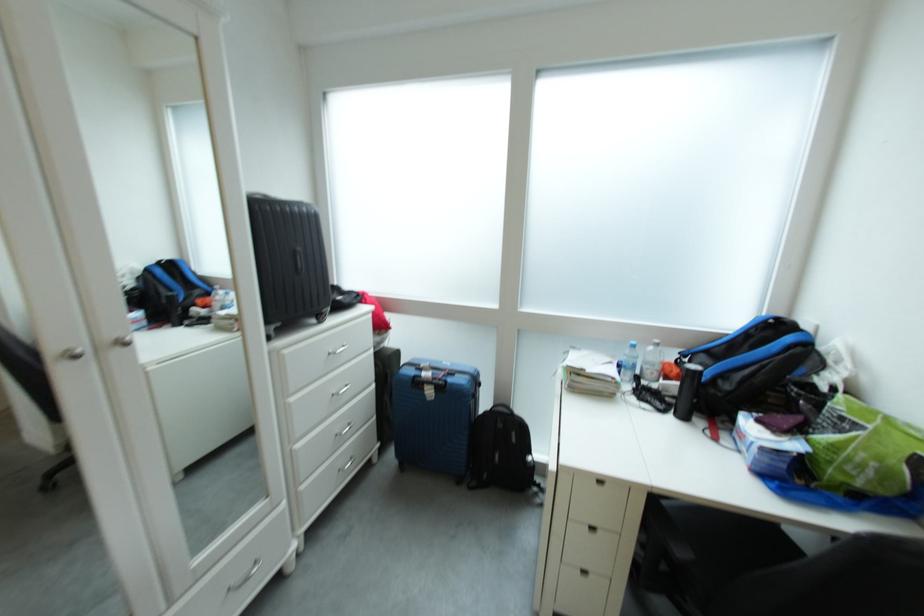
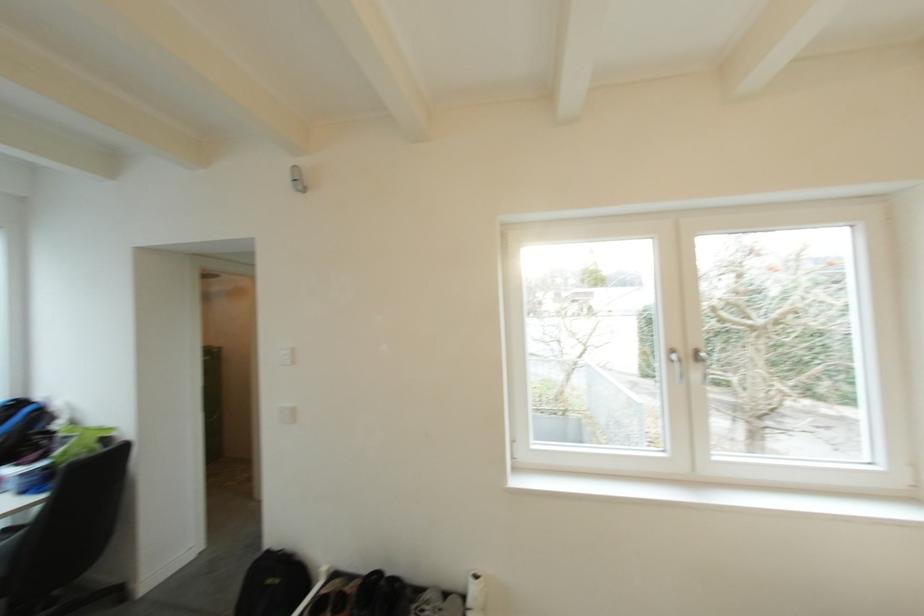
Find the pixel in the second image that matches [787,321] in the first image.

(29, 403)